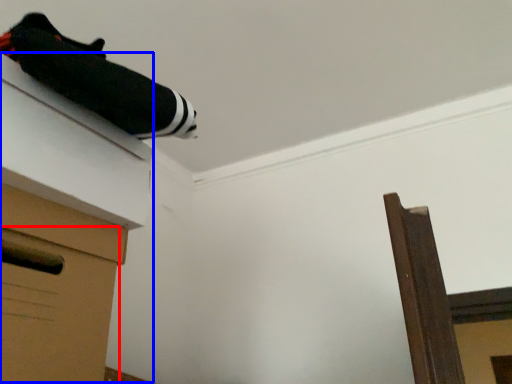
Question: Which point is closer to the camera, drawer (highlighted by a red box) or vanity (highlighted by a blue box)?

Choices:
 (A) drawer
 (B) vanity

Answer: (A)